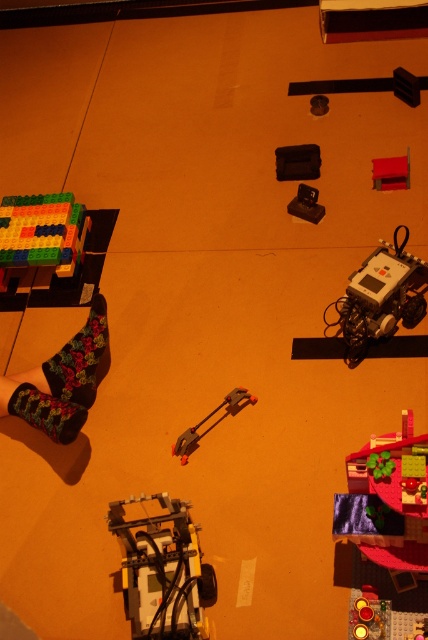
Which is more to the right, multicolored plastic blocks at upper left or black plastic toy at center?

Positioned to the right is black plastic toy at center.

Does multicolored plastic blocks at upper left have a smaller size compared to black plastic toy at center?

No.

What do you see at coordinates (41, 232) in the screenshot? The image size is (428, 640). I see `multicolored plastic blocks at upper left` at bounding box center [41, 232].

Find the location of a particular element. The image size is (428, 640). multicolored plastic blocks at upper left is located at coordinates (41, 232).

Who is taller, rubberized red toy at upper right or metallic red clamp at center?

metallic red clamp at center

Does point (376, 160) come closer to viewer compared to point (196, 428)?

No, it is not.

What do you see at coordinates (391, 172) in the screenshot? Image resolution: width=428 pixels, height=640 pixels. I see `rubberized red toy at upper right` at bounding box center [391, 172].

What are the coordinates of `rubberized red toy at upper right` in the screenshot? It's located at [391, 172].

Could you measure the distance between floral-patterned fabric sock at lower left and velvet floral socks at lower left?

floral-patterned fabric sock at lower left is 6.15 inches away from velvet floral socks at lower left.

Can you confirm if floral-patterned fabric sock at lower left is positioned below velvet floral socks at lower left?

No, floral-patterned fabric sock at lower left is not below velvet floral socks at lower left.

Who is more forward, (83, 346) or (17, 417)?

Positioned in front is point (83, 346).

Identify the location of floral-patterned fabric sock at lower left. (80, 358).